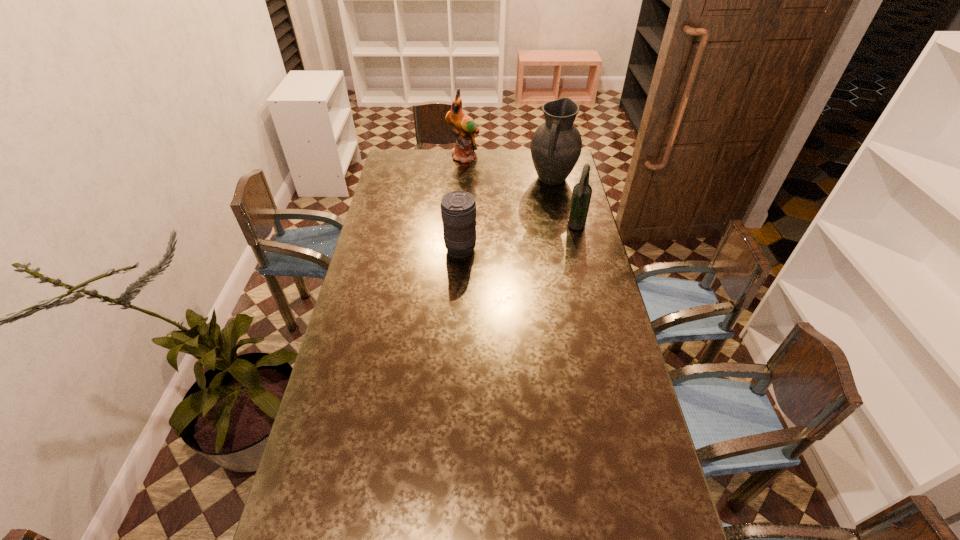
Locate an element on the screen. free space on the desktop that is between the nearest object and the second nearest object and is positioned on the side of the second farthest object with the handle is located at coordinates (527, 237).

I want to click on free spot on the desktop that is between the shortest object and the beer bottle and is positioned on the front-facing side of the parrot, so click(503, 241).